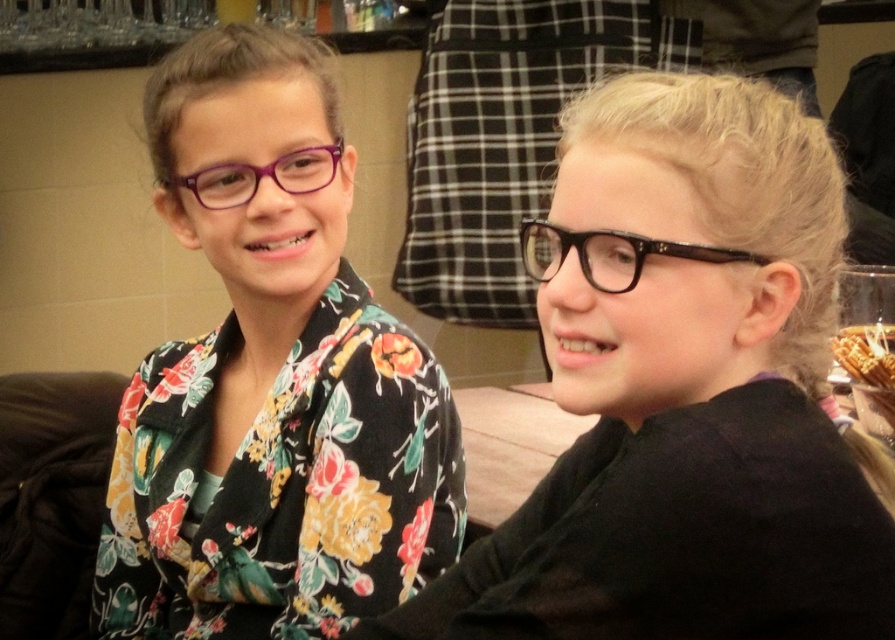
Can you confirm if matte purple glasses at left is taller than black textured glasses at right?

Indeed, matte purple glasses at left has a greater height compared to black textured glasses at right.

Does matte purple glasses at left appear on the right side of black textured glasses at right?

No, matte purple glasses at left is not to the right of black textured glasses at right.

Which is in front, point (141, 396) or point (542, 280)?

Point (542, 280) is in front.

Locate an element on the screen. The image size is (895, 640). matte purple glasses at left is located at coordinates (271, 380).

Who is more forward, (632, 564) or (644, 250)?

Point (632, 564)

This screenshot has height=640, width=895. What do you see at coordinates (683, 390) in the screenshot? I see `black glossy glasses at upper right` at bounding box center [683, 390].

The width and height of the screenshot is (895, 640). Find the location of `black glossy glasses at upper right`. black glossy glasses at upper right is located at coordinates (683, 390).

Is black textured glasses at right further to camera compared to purple acetate glasses at left?

Yes, it is behind purple acetate glasses at left.

Describe the element at coordinates (609, 253) in the screenshot. I see `black textured glasses at right` at that location.

Is point (763, 264) positioned behind point (299, 193)?

That is False.

Identify the location of black textured glasses at right. Image resolution: width=895 pixels, height=640 pixels. (609, 253).